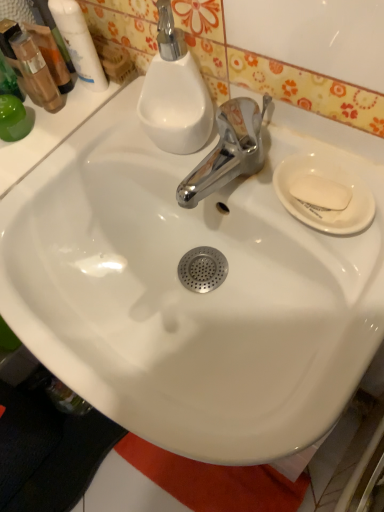
The width and height of the screenshot is (384, 512). I want to click on blank space to the left of white matte soap at right, so click(x=233, y=187).